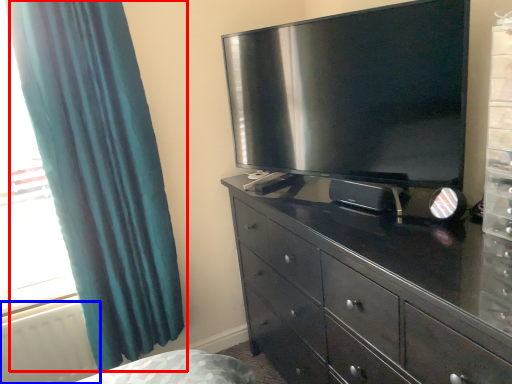
Question: Which point is closer to the camera, curtain (highlighted by a red box) or radiator (highlighted by a blue box)?

Choices:
 (A) curtain
 (B) radiator

Answer: (A)